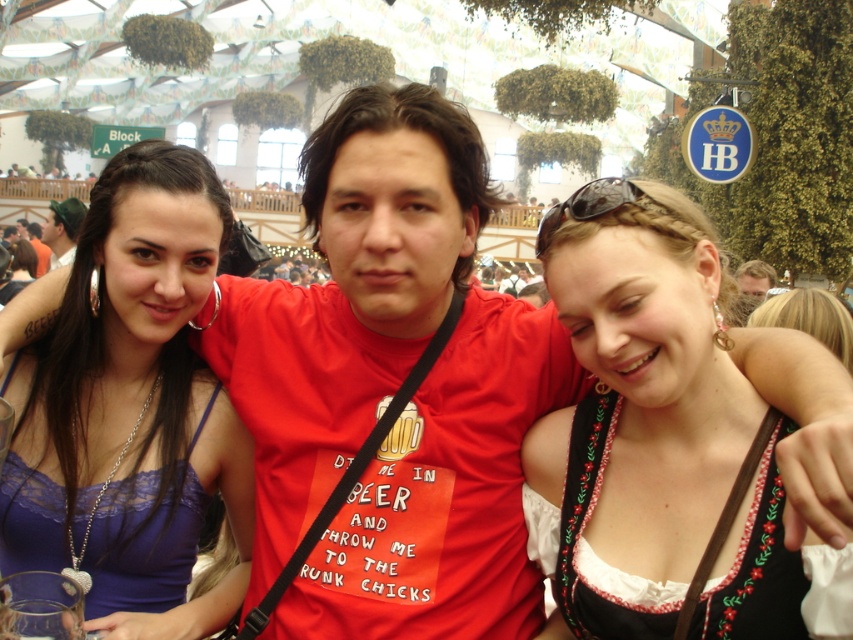
Question: Is the position of white embroidered dirndl at center more distant than that of matte black hair at left?

Choices:
 (A) no
 (B) yes

Answer: (A)

Question: Among these objects, which one is nearest to the camera?

Choices:
 (A) matte black hair at left
 (B) matte purple dress at center

Answer: (B)

Question: Is the position of lace fabric dress at left more distant than that of light brown hair at center?

Choices:
 (A) no
 (B) yes

Answer: (A)

Question: Can you confirm if black embroidered dirndl at center is smaller than light brown hair at center?

Choices:
 (A) no
 (B) yes

Answer: (B)

Question: Which object appears farthest from the camera in this image?

Choices:
 (A) matte purple dress at center
 (B) white embroidered dirndl at center
 (C) light brown hair at center

Answer: (C)

Question: Among these objects, which one is nearest to the camera?

Choices:
 (A) matte black hair at left
 (B) light brown hair at center
 (C) matte purple dress at center
 (D) black embroidered dirndl at center

Answer: (D)